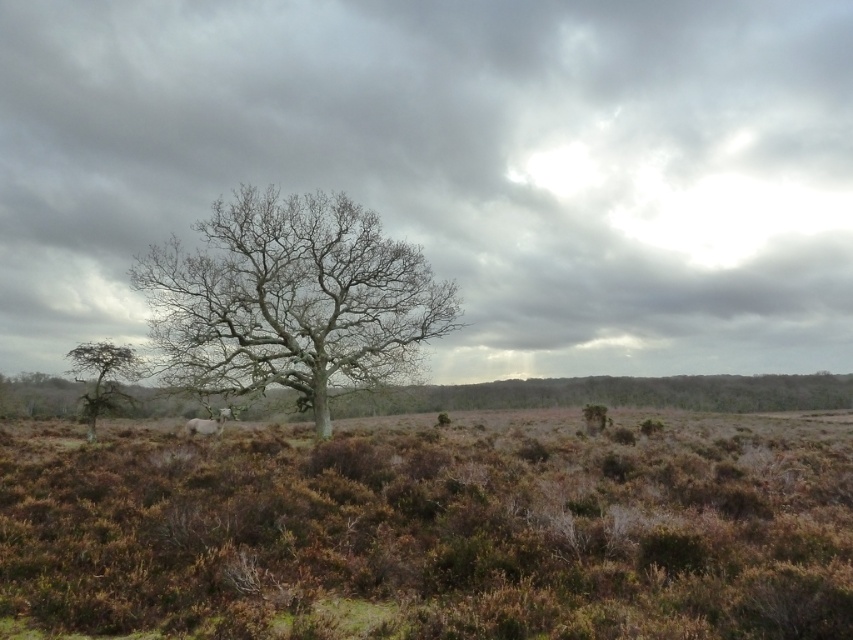
Between bare wood tree at center and white woolly sheep at center, which one appears on the left side from the viewer's perspective?

From the viewer's perspective, white woolly sheep at center appears more on the left side.

Does bare wood tree at center have a greater width compared to white woolly sheep at center?

Yes.

Who is more distant from viewer, (244, 330) or (189, 433)?

The point (189, 433) is more distant.

Identify the location of bare wood tree at center. The height and width of the screenshot is (640, 853). (289, 300).

Is point (300, 388) in front of point (96, 342)?

Yes, point (300, 388) is in front of point (96, 342).

Who is positioned more to the left, bare wood tree at center or green matte tree at lower left?

Positioned to the left is green matte tree at lower left.

The image size is (853, 640). Identify the location of bare wood tree at center. (289, 300).

Locate an element on the screen. bare wood tree at center is located at coordinates (289, 300).

Which of these two, gray cloudy sky at center or white woolly sheep at center, stands taller?

gray cloudy sky at center is taller.

Which is in front, point (666, 262) or point (193, 432)?

Positioned in front is point (193, 432).

The width and height of the screenshot is (853, 640). I want to click on gray cloudy sky at center, so click(453, 166).

Where is `gray cloudy sky at center`? This screenshot has height=640, width=853. gray cloudy sky at center is located at coordinates (453, 166).